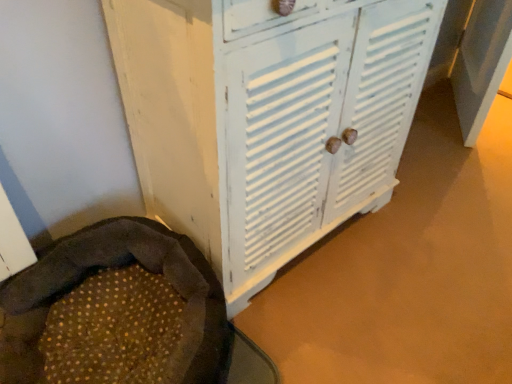
Question: Is white painted wood cupboard at center inside or outside of brown textured fabric bean bag chair at lower left?

Choices:
 (A) inside
 (B) outside

Answer: (B)

Question: From the image's perspective, is white painted wood cupboard at center positioned above or below brown textured fabric bean bag chair at lower left?

Choices:
 (A) below
 (B) above

Answer: (B)

Question: Considering the positions of white painted wood cupboard at center and brown textured fabric bean bag chair at lower left in the image, is white painted wood cupboard at center wider or thinner than brown textured fabric bean bag chair at lower left?

Choices:
 (A) wide
 (B) thin

Answer: (B)

Question: Is brown textured fabric bean bag chair at lower left taller or shorter than white painted wood cupboard at center?

Choices:
 (A) tall
 (B) short

Answer: (B)

Question: In the image, is brown textured fabric bean bag chair at lower left on the left side or the right side of white painted wood cupboard at center?

Choices:
 (A) right
 (B) left

Answer: (B)

Question: Is brown textured fabric bean bag chair at lower left wider or thinner than white painted wood cupboard at center?

Choices:
 (A) thin
 (B) wide

Answer: (B)

Question: From a real-world perspective, is brown textured fabric bean bag chair at lower left positioned above or below white painted wood cupboard at center?

Choices:
 (A) above
 (B) below

Answer: (B)